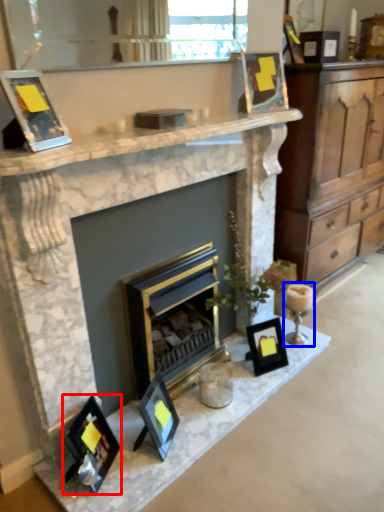
Question: Which point is further to the camera, picture frame (highlighted by a red box) or candle holder (highlighted by a blue box)?

Choices:
 (A) picture frame
 (B) candle holder

Answer: (B)